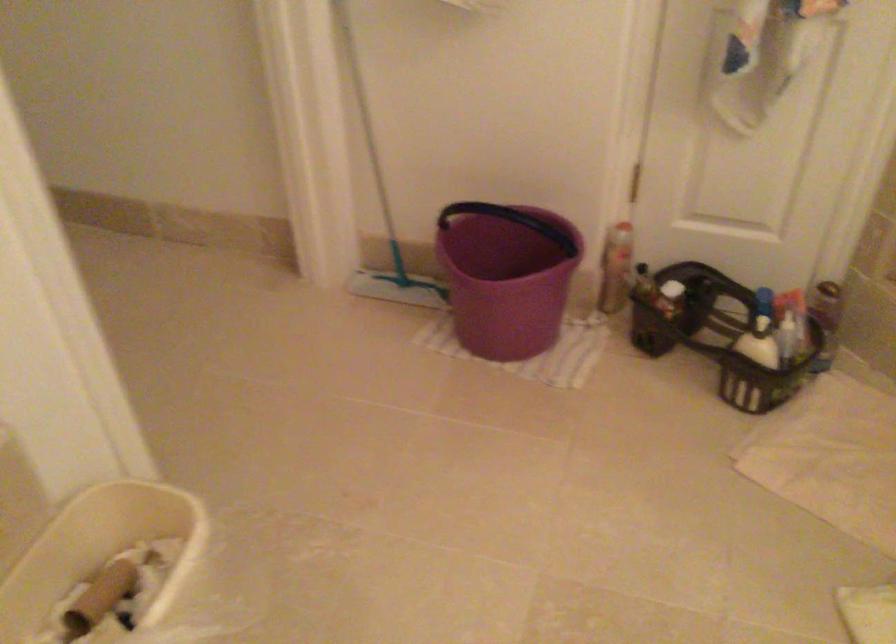
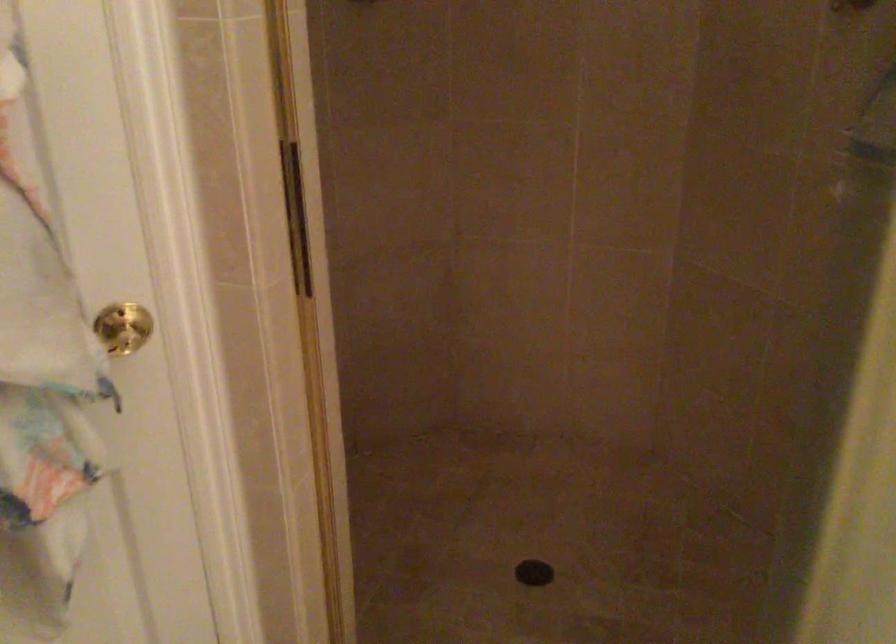
Question: The camera is either moving clockwise (left) or counter-clockwise (right) around the object. The first image is from the beginning of the video and the second image is from the end. Is the camera moving left or right when shooting the video?

Choices:
 (A) Left
 (B) Right

Answer: (A)